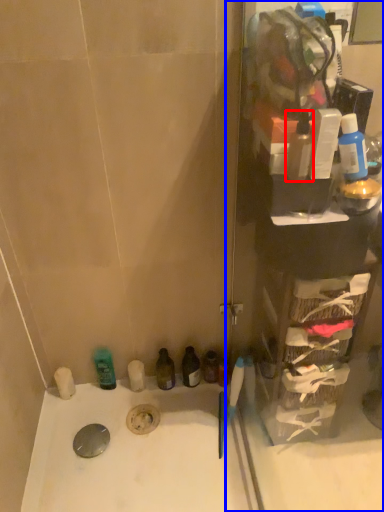
Question: Which object appears farthest to the camera in this image, mouthwash (highlighted by a red box) or glass door (highlighted by a blue box)?

Choices:
 (A) mouthwash
 (B) glass door

Answer: (A)